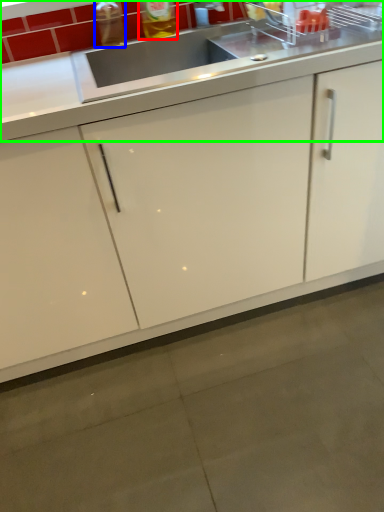
Question: Which object is positioned farthest from beverage (highlighted by a red box)? Select from bottle (highlighted by a blue box) and countertop (highlighted by a green box).

Choices:
 (A) bottle
 (B) countertop

Answer: (B)